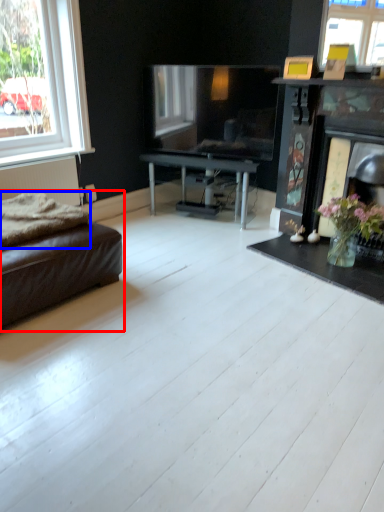
Question: Which object appears closest to the camera in this image, studio couch (highlighted by a red box) or blanket (highlighted by a blue box)?

Choices:
 (A) studio couch
 (B) blanket

Answer: (A)